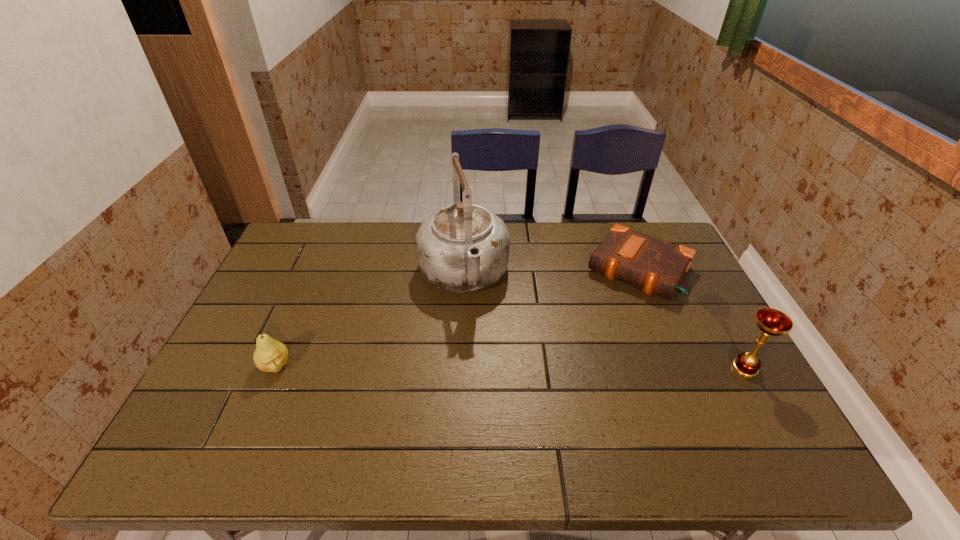
In order to click on free space at the far edge of the desktop in this screenshot , I will do `click(517, 224)`.

In the image, there is a desktop. Where is `free space at the near edge`? This screenshot has width=960, height=540. free space at the near edge is located at coordinates (403, 421).

Identify the location of vacant region at the left edge of the desktop. (241, 390).

Locate an element on the screen. The height and width of the screenshot is (540, 960). vacant space in between the kettle and the third tallest object is located at coordinates (370, 320).

This screenshot has height=540, width=960. In order to click on empty location between the shortest object and the second shortest object in this screenshot , I will do `click(457, 318)`.

Identify the location of empty space that is in between the kettle and the second tallest object. (605, 321).

The image size is (960, 540). What are the coordinates of `free space between the second tallest object and the third object from right to left` in the screenshot? It's located at (605, 321).

At what (x,y) coordinates should I click in order to perform the action: click on free space that is in between the leftmost object and the second tallest object. Please return your answer as a coordinate pair (x, y). The image size is (960, 540). Looking at the image, I should click on (510, 367).

Locate an element on the screen. vacant region between the third object from right to left and the Bible is located at coordinates [x=551, y=272].

Where is `blank region between the chalice and the Bible`? blank region between the chalice and the Bible is located at coordinates (692, 319).